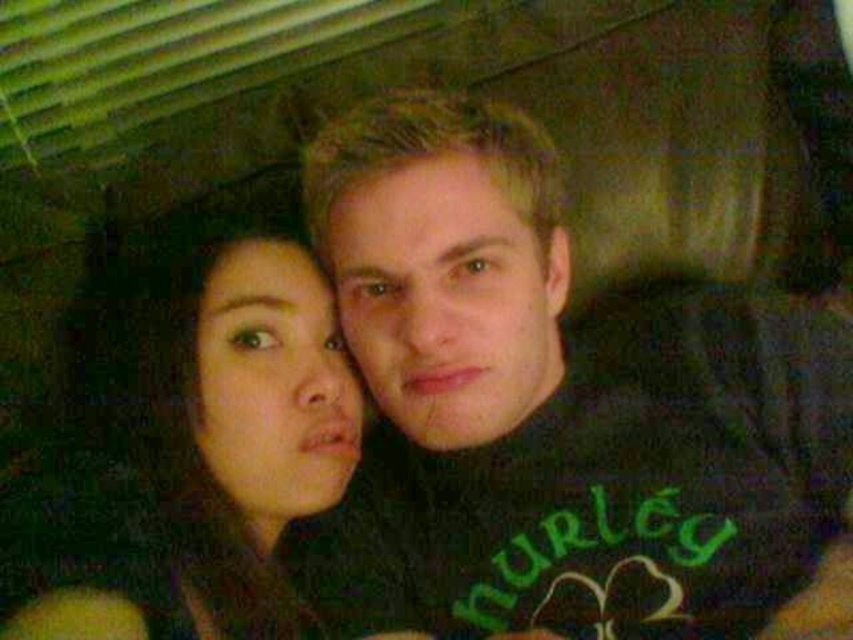
Question: Which of the following is the farthest from the observer?

Choices:
 (A) click(677, 324)
 (B) click(268, 481)

Answer: (A)

Question: Among these objects, which one is farthest from the camera?

Choices:
 (A) matte black shirt at center
 (B) smooth skin face at center

Answer: (A)

Question: Which object appears closest to the camera in this image?

Choices:
 (A) matte black shirt at center
 (B) smooth skin face at center

Answer: (B)

Question: Is matte black shirt at center bigger than smooth skin face at center?

Choices:
 (A) yes
 (B) no

Answer: (A)

Question: Is matte black shirt at center behind smooth skin face at center?

Choices:
 (A) yes
 (B) no

Answer: (A)

Question: Can you confirm if matte black shirt at center is positioned to the left of smooth skin face at center?

Choices:
 (A) no
 (B) yes

Answer: (A)